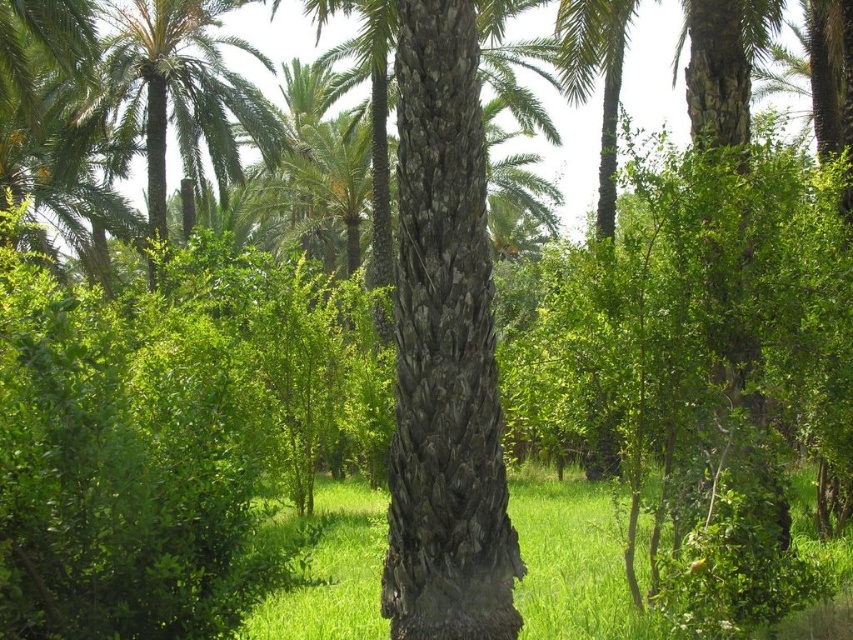
Based on the photo, you are standing in the lush environment and want to find the green grass at center. Based on the scene, where should you look relative to the green textured palm tree at upper left?

The green grass at center is located below the green textured palm tree at upper left, so you should look downward from the palm tree to find it.

You are standing in the lush green environment and want to determine the relative positions of two points marked in the scene. Which point, point (x=291, y=592) or point (x=230, y=163), is closer to you?

Point (x=291, y=592) is closer to the viewer than point (x=230, y=163) according to the description.

You are a gardener trying to determine which plant is taller between the green grass at center and the green textured palm tree at upper left. Based on the scene, which one is taller?

The green grass at center is taller than the green textured palm tree at upper left according to the description.